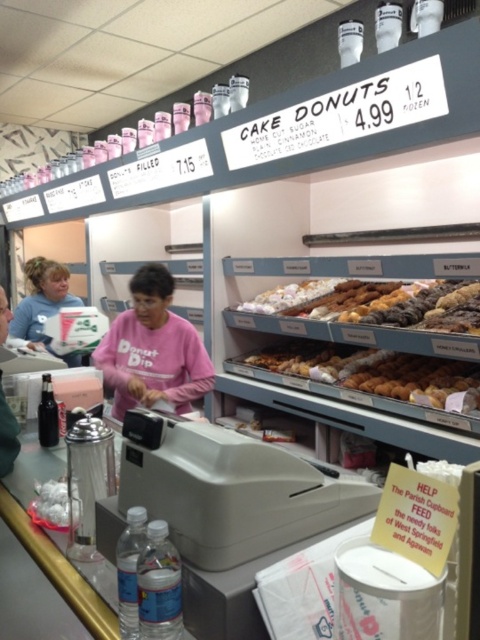
You are a baker who needs to retrieve both the golden brown doughnut at center and the glazed sugar donut at center from the display case. Which one would you have to move first to access the other?

The golden brown doughnut at center is positioned under the glazed sugar donut at center, so you would need to move the glazed sugar donut at center first to access the golden brown doughnut at center.

You are a customer at the bakery and want to pick up your order. Where should you go first, the matte blue shirt at upper left or the white plastic bag at lower left, to get assistance?

The matte blue shirt at upper left is to the left of the white plastic bag at lower left, so you should go to the matte blue shirt at upper left first to get assistance.

You are a customer in the bakery and want to choose between the pink cotton shirt at center and the matte blue shirt at upper left. Which shirt is smaller in size?

The pink cotton shirt at center has a smaller size compared to matte blue shirt at upper left, so the pink cotton shirt at center is smaller.